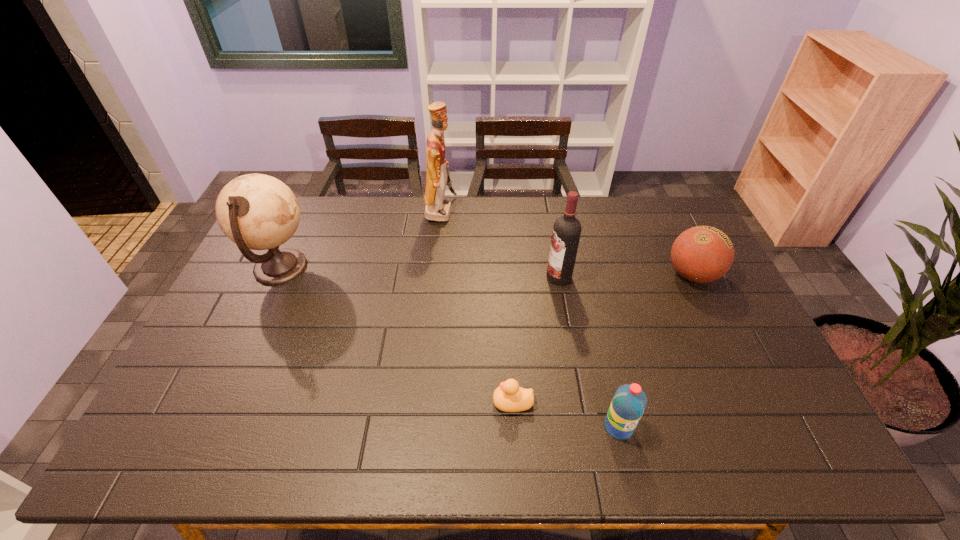
You are a GUI agent. You are given a task and a screenshot of the screen. Output one action in this format:
    pyautogui.click(x=<x>, y=<y>)
    Task: Click on the second object from left to right
    The width and height of the screenshot is (960, 540).
    Given the screenshot: What is the action you would take?
    pyautogui.click(x=437, y=208)

Find the location of a particular element. Image resolution: width=960 pixels, height=540 pixels. nutcracker is located at coordinates (437, 208).

This screenshot has height=540, width=960. Identify the location of globe. (259, 212).

At what (x,y) coordinates should I click in order to perform the action: click on the third object from right to left. Please return your answer as a coordinate pair (x, y). The image size is (960, 540). Looking at the image, I should click on (566, 233).

Image resolution: width=960 pixels, height=540 pixels. In order to click on the rightmost object in this screenshot , I will do [702, 254].

The height and width of the screenshot is (540, 960). I want to click on the fifth object from left to right, so click(x=629, y=402).

At what (x,y) coordinates should I click in order to perform the action: click on duck. Please return your answer as a coordinate pair (x, y). This screenshot has width=960, height=540. Looking at the image, I should click on (509, 397).

This screenshot has height=540, width=960. I want to click on the third object from left to right, so click(x=509, y=397).

At what (x,y) coordinates should I click in order to perform the action: click on vacant space located on the front-facing side of the second object from left to right. Please return your answer as a coordinate pair (x, y). Image resolution: width=960 pixels, height=540 pixels. Looking at the image, I should click on (519, 212).

The width and height of the screenshot is (960, 540). I want to click on vacant space situated on the front-facing side of the globe, so click(348, 268).